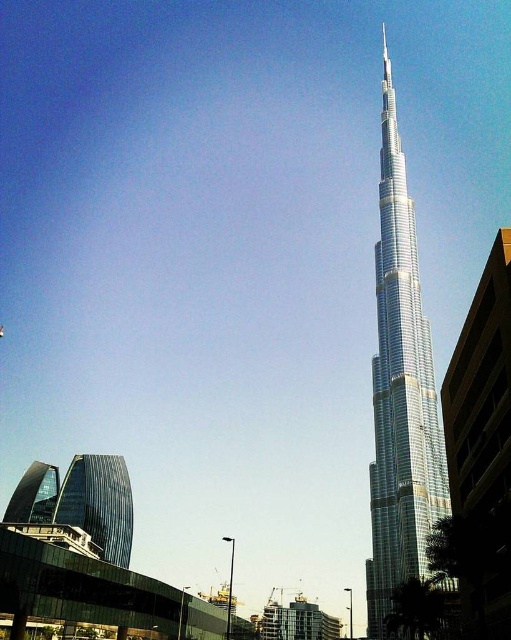
Between shiny glass skyscraper at right and glassy reflective skyscraper at lower left, which one appears on the left side from the viewer's perspective?

From the viewer's perspective, glassy reflective skyscraper at lower left appears more on the left side.

From the picture: Between shiny glass skyscraper at right and glassy reflective skyscraper at lower left, which one is positioned higher?

shiny glass skyscraper at right is above.

Between point (384, 520) and point (129, 509), which one is positioned in front?

Point (384, 520)

Find the location of a particular element. The height and width of the screenshot is (640, 511). shiny glass skyscraper at right is located at coordinates (401, 392).